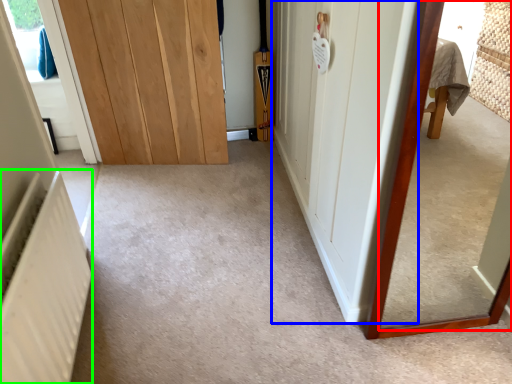
Question: Based on their relative distances, which object is farther from mirror (highlighted by a red box)? Choose from door (highlighted by a blue box) and radiator (highlighted by a green box).

Choices:
 (A) door
 (B) radiator

Answer: (B)